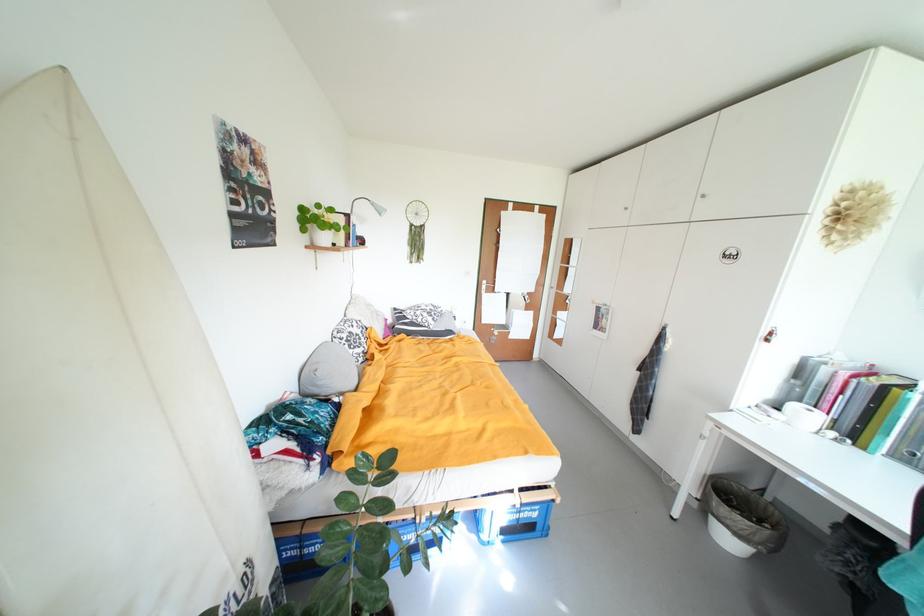
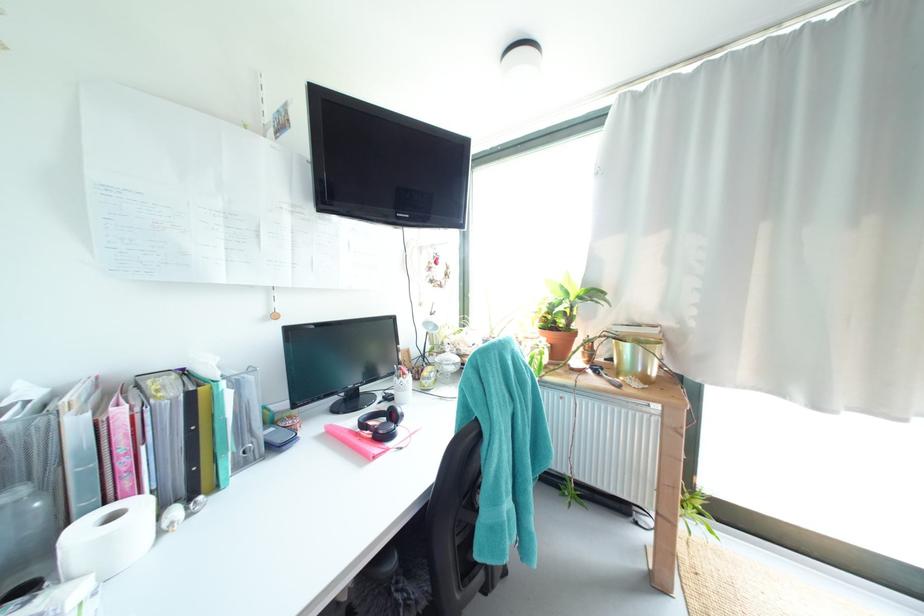
Locate, in the second image, the point that corresponds to (833,408) in the first image.

(135, 485)